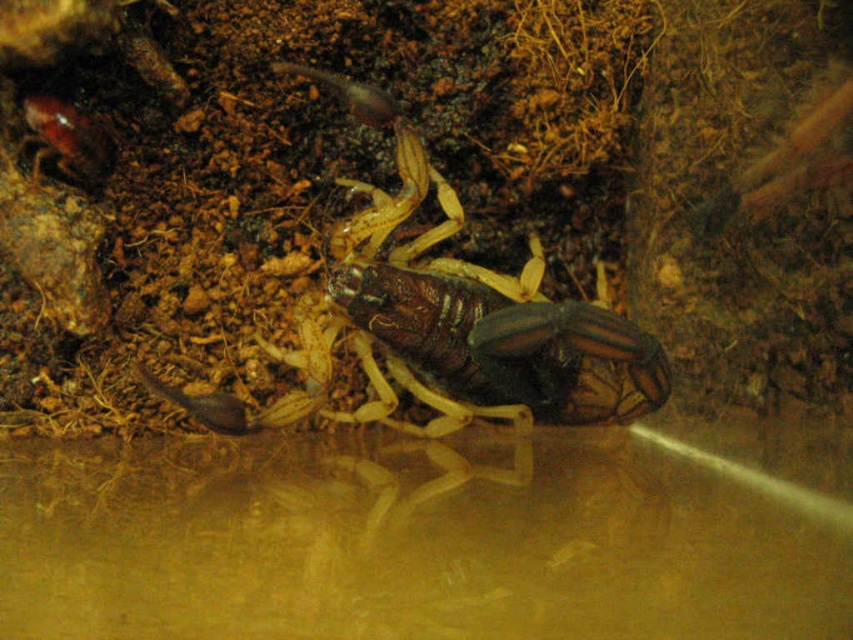
You are observing a scorpion in its terrarium. You notice two points marked in the image. The first point is at coordinate point (508, 348) and the second point is at coordinate point (77, 108). From your perspective, which point is closer to you?

Point (508, 348) is in front of point (77, 108), so it is closer to you.

You are a researcher holding a 1.5 meter long measuring rod. You want to reach the point at coordinates point (373, 282) in the enclosure to collect a sample. Can your rod reach that point?

The distance of point (373, 282) from the camera is 1.51 meters. Since the measuring rod is 1.5 meters long, it is slightly shorter than the required distance. Therefore, the rod cannot reach the point.

You are observing a terrarium and notice two creatures inside. You see the brown shiny scorpion at center and the shiny brown beetle at upper left. Which creature is positioned closer to you?

The brown shiny scorpion at center is closer to the viewer than the shiny brown beetle at upper left.